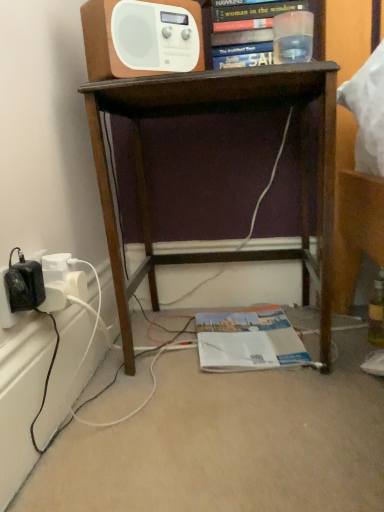
Question: Can you confirm if brown wood desk at center is wider than white glossy magazine at lower center?

Choices:
 (A) no
 (B) yes

Answer: (B)

Question: From the image's perspective, does brown wood desk at center appear lower than white glossy magazine at lower center?

Choices:
 (A) yes
 (B) no

Answer: (B)

Question: From a real-world perspective, is brown wood desk at center beneath white glossy magazine at lower center?

Choices:
 (A) no
 (B) yes

Answer: (A)

Question: Could white glossy magazine at lower center be considered to be inside brown wood desk at center?

Choices:
 (A) no
 (B) yes

Answer: (B)

Question: Is brown wood desk at center taller than white glossy magazine at lower center?

Choices:
 (A) yes
 (B) no

Answer: (A)

Question: From the image's perspective, relative to hardcover book at upper center, is white plastic radio at upper center above or below?

Choices:
 (A) below
 (B) above

Answer: (A)

Question: Considering the positions of point tap(102, 53) and point tap(271, 22), is point tap(102, 53) closer or farther from the camera than point tap(271, 22)?

Choices:
 (A) farther
 (B) closer

Answer: (B)

Question: Based on their positions, is white plastic radio at upper center located to the left or right of hardcover book at upper center?

Choices:
 (A) right
 (B) left

Answer: (B)

Question: In terms of size, does white plastic radio at upper center appear bigger or smaller than hardcover book at upper center?

Choices:
 (A) small
 (B) big

Answer: (A)

Question: Looking at their shapes, would you say white glossy magazine at lower center is wider or thinner than hardcover book at upper center?

Choices:
 (A) thin
 (B) wide

Answer: (B)

Question: Is white glossy magazine at lower center in front of or behind hardcover book at upper center in the image?

Choices:
 (A) behind
 (B) front

Answer: (A)

Question: Looking at the image, does white glossy magazine at lower center seem bigger or smaller compared to hardcover book at upper center?

Choices:
 (A) big
 (B) small

Answer: (B)

Question: In terms of height, does white glossy magazine at lower center look taller or shorter compared to hardcover book at upper center?

Choices:
 (A) tall
 (B) short

Answer: (B)

Question: Is point (301, 105) closer or farther from the camera than point (243, 335)?

Choices:
 (A) closer
 (B) farther

Answer: (B)

Question: From their relative heights in the image, would you say brown wood desk at center is taller or shorter than white glossy magazine at lower center?

Choices:
 (A) tall
 (B) short

Answer: (A)